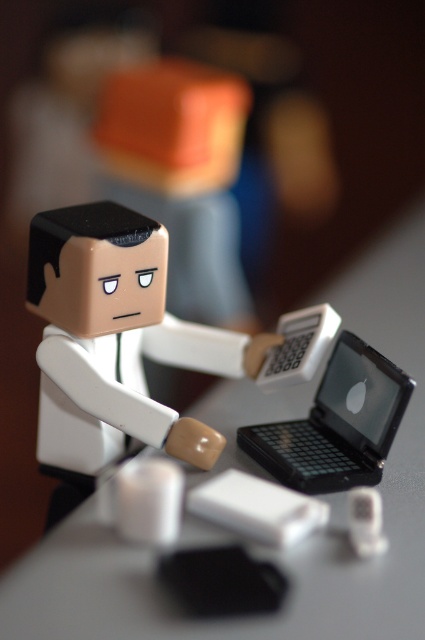
You are a photographer trying to capture a detailed closeup of the LEGO figurine and its laptop. The camera you are using has a depth of field that can focus clearly on objects within 30 inches. Based on the scene, will the point at coordinates point (116, 294) be in focus?

The distance between point (116, 294) and the camera is 35.32 inches, which is beyond the 30 inch focus range. Therefore, the point at coordinates point (116, 294) will not be in focus.

You are a photographer trying to capture the white matte figure at center in your shot. The camera focuses on the point at coordinates point (x=116, y=340). Will the white matte figure at center be in focus?

The white matte figure at center is located at point (x=116, y=340), so yes, the figure will be in focus since the camera is focusing on that exact point.